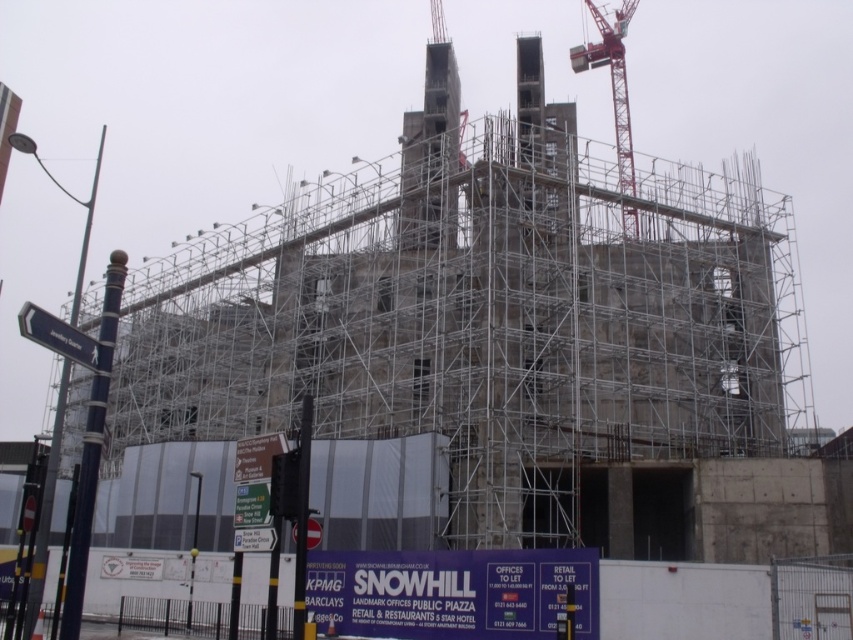
You are a construction worker standing at the base of the building. You need to move the red metal crane at upper right to a new location. Which direction should you move it to avoid blocking the entrance? The entrance is located at the lower left corner of the building.

The red metal crane at upper right is currently at point (612,80). To avoid blocking the entrance at the lower left corner, move it to the southwest direction.

Looking at this image, you are a delivery driver approaching the construction site and need to locate the Snowhill office. You see a red metal crane at upper right and a white plastic street sign at left. Which object should you look to first to find directions to the Snowhill office?

The white plastic street sign at left provides information about the Snowhill office, so you should look at the white plastic street sign at left first for directions.

Looking at this image, you are a construction worker standing at the point labeled point (612, 80). What object is directly in front of you?

The point (612, 80) indicates the red metal crane at upper right, so the object directly in front of you is the red metal crane at upper right.